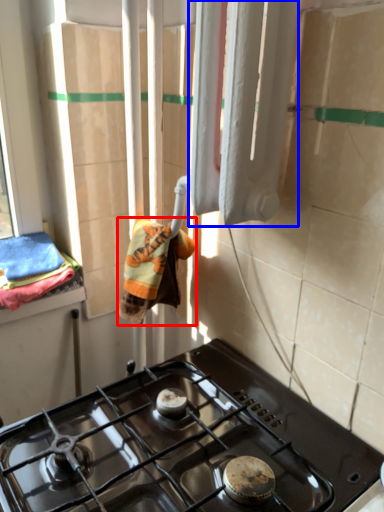
Question: Which point is further to the camera, bath towel (highlighted by a red box) or curtain (highlighted by a blue box)?

Choices:
 (A) bath towel
 (B) curtain

Answer: (A)